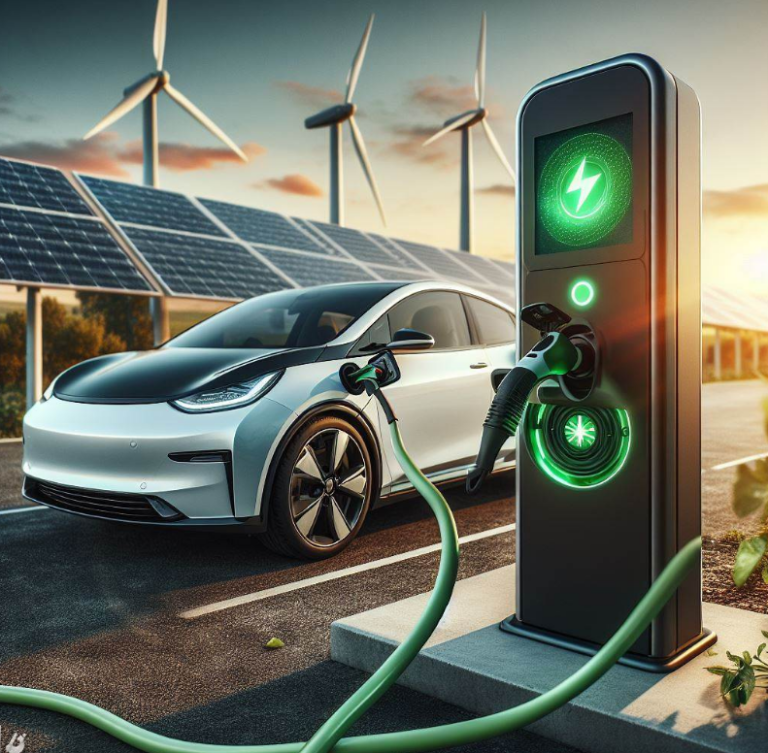
This screenshot has height=753, width=768. Identify the location of charger. (356, 379).